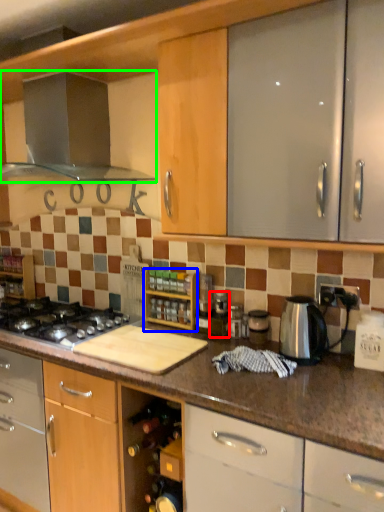
Question: Which object is the farthest from appliance (highlighted by a red box)? Choose among these: shelf (highlighted by a blue box) or kitchen appliance (highlighted by a green box).

Choices:
 (A) shelf
 (B) kitchen appliance

Answer: (B)